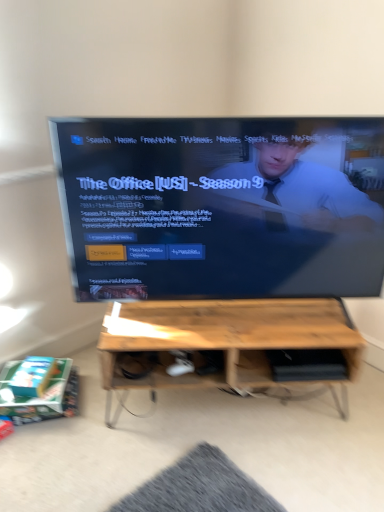
Question: Is matte black tv at center inside the boundaries of wooden table at center, or outside?

Choices:
 (A) inside
 (B) outside

Answer: (B)

Question: Considering the positions of matte black tv at center and wooden table at center in the image, is matte black tv at center taller or shorter than wooden table at center?

Choices:
 (A) short
 (B) tall

Answer: (B)

Question: In the image, is matte black tv at center positioned in front of or behind wooden table at center?

Choices:
 (A) behind
 (B) front

Answer: (B)

Question: Would you say wooden table at center is to the left or to the right of matte black tv at center in the picture?

Choices:
 (A) left
 (B) right

Answer: (B)

Question: From their relative heights in the image, would you say wooden table at center is taller or shorter than matte black tv at center?

Choices:
 (A) short
 (B) tall

Answer: (A)

Question: From a real-world perspective, relative to matte black tv at center, is wooden table at center vertically above or below?

Choices:
 (A) above
 (B) below

Answer: (B)

Question: Does point (238, 361) appear closer or farther from the camera than point (302, 131)?

Choices:
 (A) closer
 (B) farther

Answer: (B)